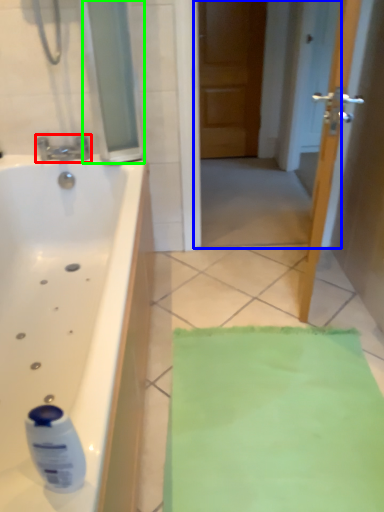
Question: Estimate the real-world distances between objects in this image. Which object is closer to tap (highlighted by a red box), screen door (highlighted by a blue box) or glass door (highlighted by a green box)?

Choices:
 (A) screen door
 (B) glass door

Answer: (B)